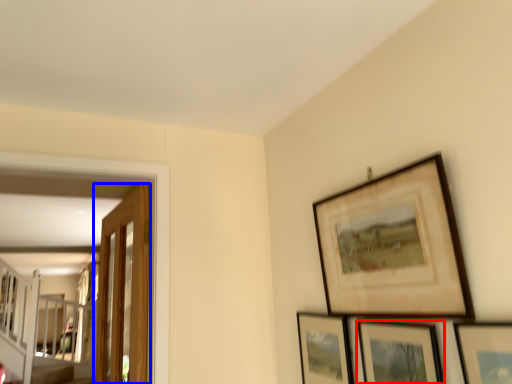
Question: Among these objects, which one is farthest to the camera, picture frame (highlighted by a red box) or door (highlighted by a blue box)?

Choices:
 (A) picture frame
 (B) door

Answer: (B)